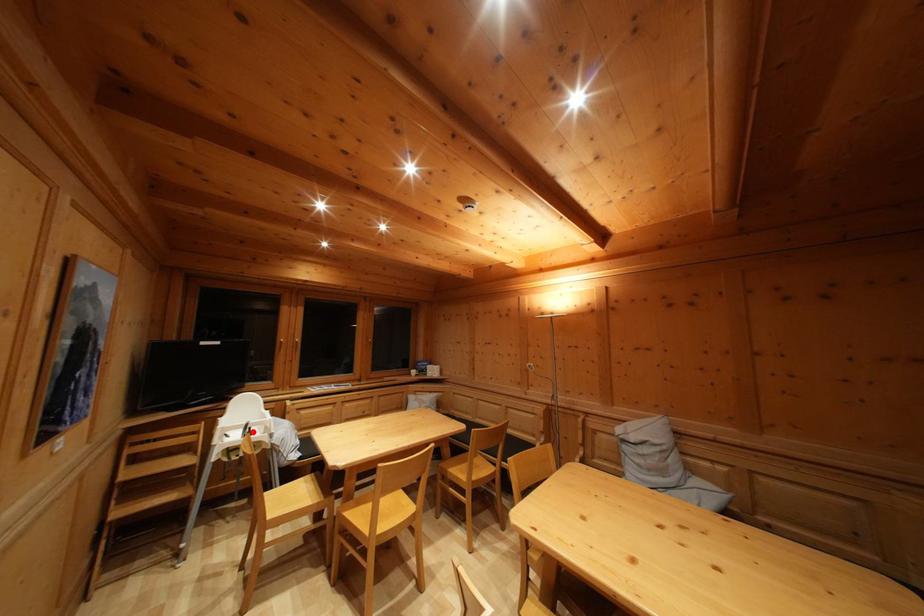
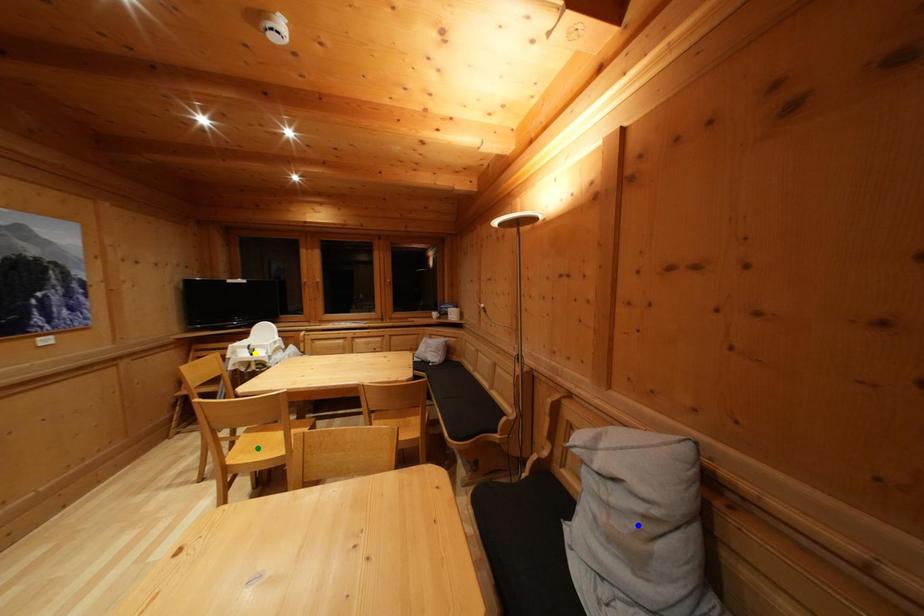
Question: I am providing you with two images of the same scene from different viewpoints. A red point is marked on the first image. You are given multiple points on the second image. Can you choose the point in image 2 that corresponds to the point in image 1?

Choices:
 (A) yellow point
 (B) blue point
 (C) green point

Answer: (A)